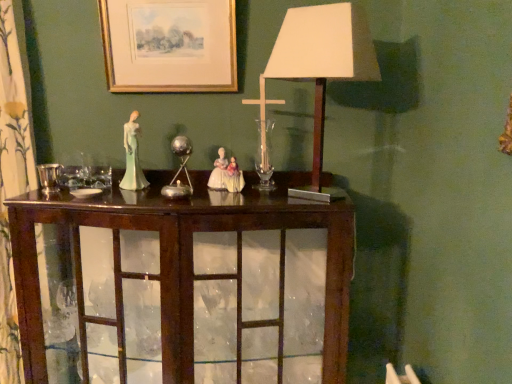
Find the location of `vacant space that is to the left of porcelain figure at center`. vacant space that is to the left of porcelain figure at center is located at coordinates pos(69,194).